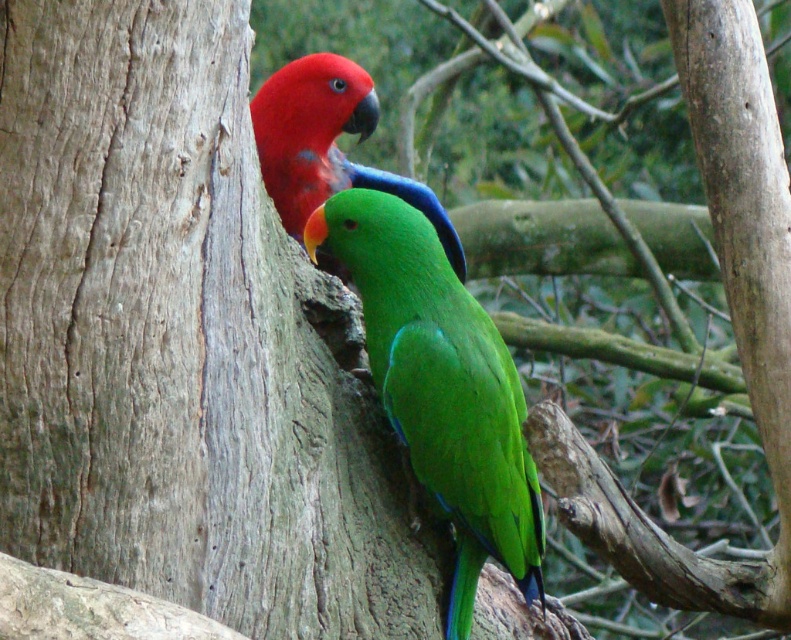
Question: Is green glossy parrot at center smaller than matte red parrot at upper left?

Choices:
 (A) yes
 (B) no

Answer: (B)

Question: Observing the image, what is the correct spatial positioning of green glossy parrot at center in reference to matte red parrot at upper left?

Choices:
 (A) left
 (B) right

Answer: (B)

Question: Which object appears closest to the camera in this image?

Choices:
 (A) green glossy parrot at center
 (B) matte red parrot at upper left

Answer: (B)

Question: Which point is closer to the camera?

Choices:
 (A) (441, 218)
 (B) (468, 401)

Answer: (B)

Question: Is green glossy parrot at center behind matte red parrot at upper left?

Choices:
 (A) yes
 (B) no

Answer: (A)

Question: Among these points, which one is farthest from the camera?

Choices:
 (A) (318, 132)
 (B) (432, 413)

Answer: (A)